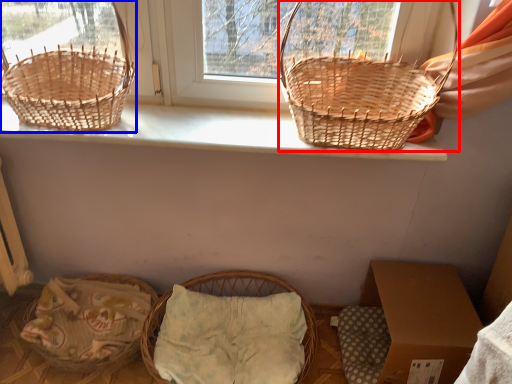
Question: Which of the following is the farthest to the observer, picnic basket (highlighted by a red box) or picnic basket (highlighted by a blue box)?

Choices:
 (A) picnic basket
 (B) picnic basket

Answer: (B)